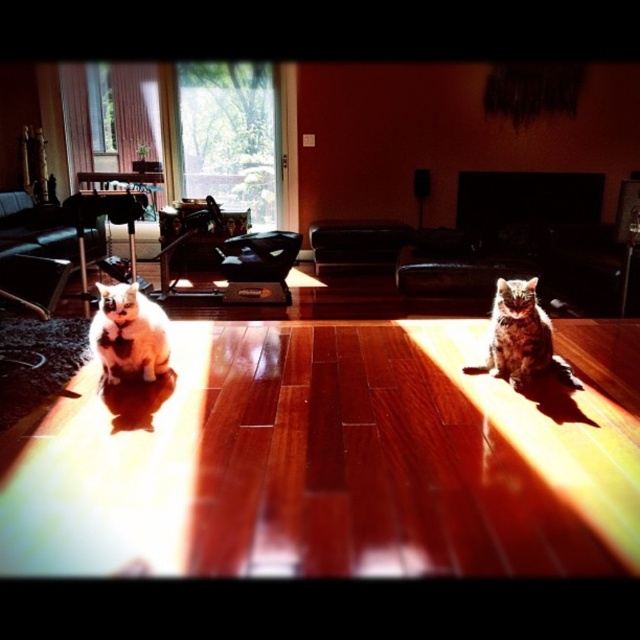
You are a photographer setting up a shot in this living room. You want to ensure both the white fluffy cat at left and the tabby fur cat at center are fully visible in the frame. Given their positions, which cat might be partially obscured if you focus on the one further back?

The tabby fur cat at center is further back than the white fluffy cat at left, so focusing on the tabby fur cat at center might cause the white fluffy cat at left to be partially obscured.

You are standing in the living room and want to pick up an object located at point (x=112, y=344) and another object at point (x=493, y=342). Which point will require you to bend down less to reach?

Point (x=112, y=344) is closer to the camera than point (x=493, y=342), so you will need to bend down less to reach the object at point (x=112, y=344).